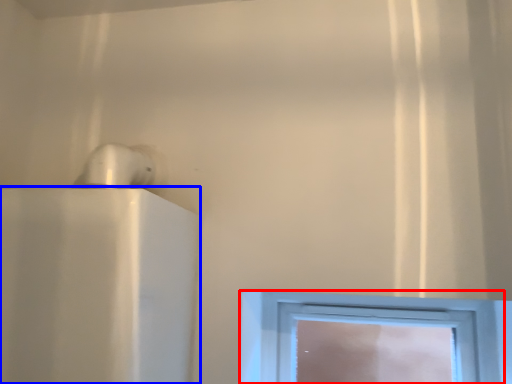
Question: Which object is further to the camera taking this photo, window (highlighted by a red box) or appliance (highlighted by a blue box)?

Choices:
 (A) window
 (B) appliance

Answer: (A)